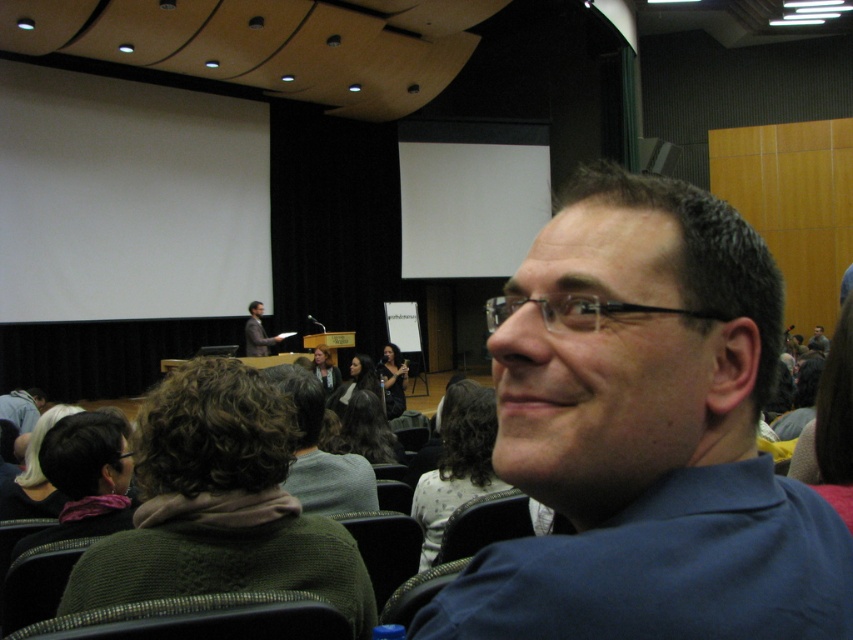
Question: Can you confirm if curly brown hair at center is positioned below light brown hair at center?

Choices:
 (A) no
 (B) yes

Answer: (B)

Question: Among these points, which one is farthest from the camera?

Choices:
 (A) (91, 417)
 (B) (268, 348)
 (C) (654, 243)
 (D) (328, 392)

Answer: (B)

Question: Which point is closer to the camera?

Choices:
 (A) (466, 416)
 (B) (401, 356)

Answer: (A)

Question: Where is curly brown hair at center located in relation to dark brown hair at center in the image?

Choices:
 (A) below
 (B) above

Answer: (A)

Question: Is white dotted shirt at center positioned at the back of light brown hair at center?

Choices:
 (A) yes
 (B) no

Answer: (B)

Question: Among these points, which one is farthest from the camera?

Choices:
 (A) pyautogui.click(x=341, y=397)
 (B) pyautogui.click(x=813, y=342)
 (C) pyautogui.click(x=318, y=371)
 (D) pyautogui.click(x=7, y=486)

Answer: (B)